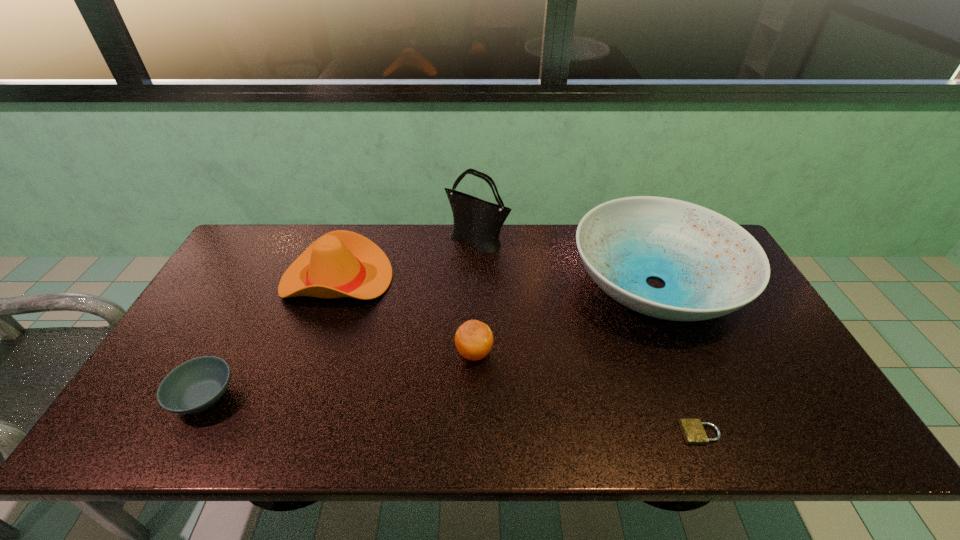
Identify the location of vacant area situated 0.230m on the back of the fifth tallest object. (252, 305).

Identify the location of vacant point located 0.370m on the keyhole side of the padlock. (516, 433).

Locate an element on the screen. Image resolution: width=960 pixels, height=540 pixels. vacant area located 0.380m on the keyhole side of the padlock is located at coordinates (512, 433).

Find the location of a particular element. The width and height of the screenshot is (960, 540). vacant region located 0.310m on the keyhole side of the padlock is located at coordinates (543, 433).

This screenshot has width=960, height=540. I want to click on shoulder bag positioned at the far edge, so (479, 222).

Identify the location of dish located at the far edge. (711, 266).

Locate an element on the screen. This screenshot has height=540, width=960. cowboy hat located in the far edge section of the desktop is located at coordinates (341, 263).

Find the location of a particular element. This screenshot has height=540, width=960. soup bowl that is at the near edge is located at coordinates [197, 384].

The width and height of the screenshot is (960, 540). What are the coordinates of `padlock present at the near edge` in the screenshot? It's located at (693, 431).

Identify the location of object present at the left edge. The width and height of the screenshot is (960, 540). (197, 384).